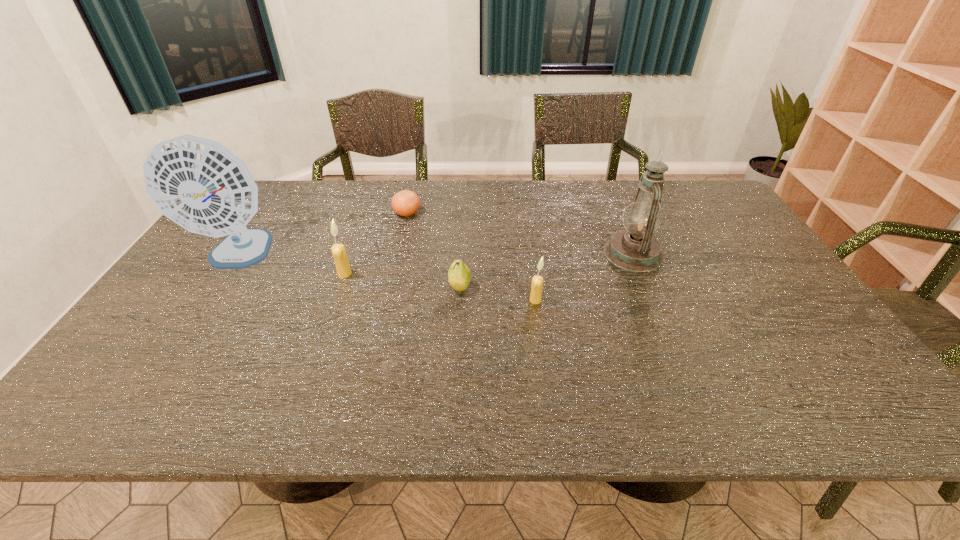
The width and height of the screenshot is (960, 540). Find the location of `vacant space at the left edge of the desktop`. vacant space at the left edge of the desktop is located at coordinates (157, 300).

This screenshot has width=960, height=540. I want to click on free location at the right edge, so click(x=739, y=298).

The height and width of the screenshot is (540, 960). What are the coordinates of `free region at the far right corner of the desktop` in the screenshot? It's located at (706, 210).

This screenshot has width=960, height=540. I want to click on free space between the rightmost object and the third object from left to right, so click(x=520, y=233).

Where is `vacant space in between the fourth tallest object and the fourth object from left to right`? The image size is (960, 540). vacant space in between the fourth tallest object and the fourth object from left to right is located at coordinates (497, 294).

Locate an element on the screen. free space between the leftmost object and the shortest object is located at coordinates (323, 234).

You are a GUI agent. You are given a task and a screenshot of the screen. Output one action in this format:
    pyautogui.click(x=<x>, y=<y>)
    Task: Click on the vacant point located between the leftmost object and the nearer candle
    
    Given the screenshot: What is the action you would take?
    pyautogui.click(x=387, y=278)

Find the location of a particular element. The image size is (960, 540). vacant area between the fourth tallest object and the third object from right to left is located at coordinates (497, 294).

The image size is (960, 540). Identify the location of free spot between the shortest object and the leftmost object. (323, 234).

You are a GUI agent. You are given a task and a screenshot of the screen. Output one action in this format:
    pyautogui.click(x=<x>, y=<y>)
    Task: Click on the vacant space in between the third tallest object and the fan
    The image size is (960, 540).
    Given the screenshot: What is the action you would take?
    pyautogui.click(x=292, y=265)